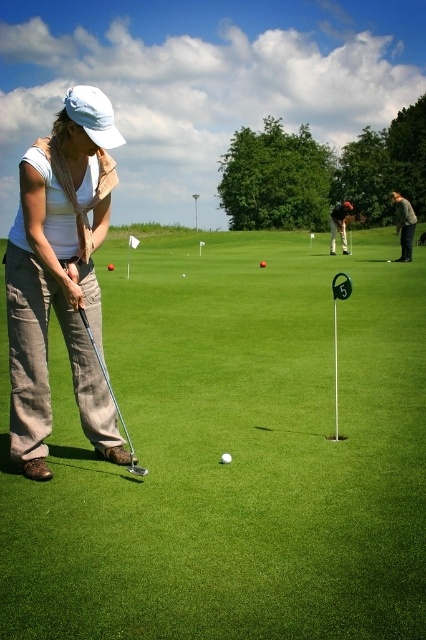
Does matte white cap at upper left have a greater width compared to green matte golf ball at center?

Indeed, matte white cap at upper left has a greater width compared to green matte golf ball at center.

Is point (80, 301) in front of point (229, 454)?

Yes, it is.

You are a GUI agent. You are given a task and a screenshot of the screen. Output one action in this format:
    pyautogui.click(x=<x>, y=<y>)
    Task: Click on the matte white cap at upper left
    This screenshot has height=640, width=426.
    Given the screenshot: What is the action you would take?
    click(x=60, y=276)

Between point (26, 550) and point (109, 435), which one is positioned behind?

The point (109, 435) is behind.

Does green grass at center have a greater height compared to matte white cap at upper left?

Yes.

Identify the location of green grass at center. (233, 452).

You are a GUI agent. You are given a task and a screenshot of the screen. Output one action in this format:
    pyautogui.click(x=<x>, y=<y>)
    Task: Click on the green grass at center
    The image size is (426, 640).
    Given the screenshot: What is the action you would take?
    pyautogui.click(x=233, y=452)

Based on the photo, can you confirm if metallic silver putter at left is taller than green matte golf ball at center?

Correct, metallic silver putter at left is much taller as green matte golf ball at center.

Does metallic silver putter at left appear under green matte golf ball at center?

Actually, metallic silver putter at left is above green matte golf ball at center.

Image resolution: width=426 pixels, height=640 pixels. I want to click on metallic silver putter at left, so click(x=112, y=396).

You are a GUI agent. You are given a task and a screenshot of the screen. Output one action in this format:
    pyautogui.click(x=<x>, y=<y>)
    Task: Click on the metallic silver putter at left
    
    Given the screenshot: What is the action you would take?
    pyautogui.click(x=112, y=396)